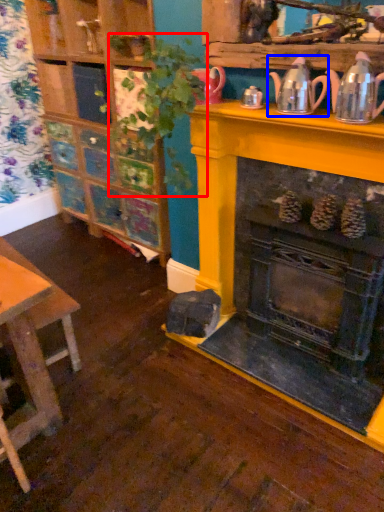
Question: Which of the following is the closest to the observer, plant (highlighted by a red box) or tea pot (highlighted by a blue box)?

Choices:
 (A) plant
 (B) tea pot

Answer: (A)